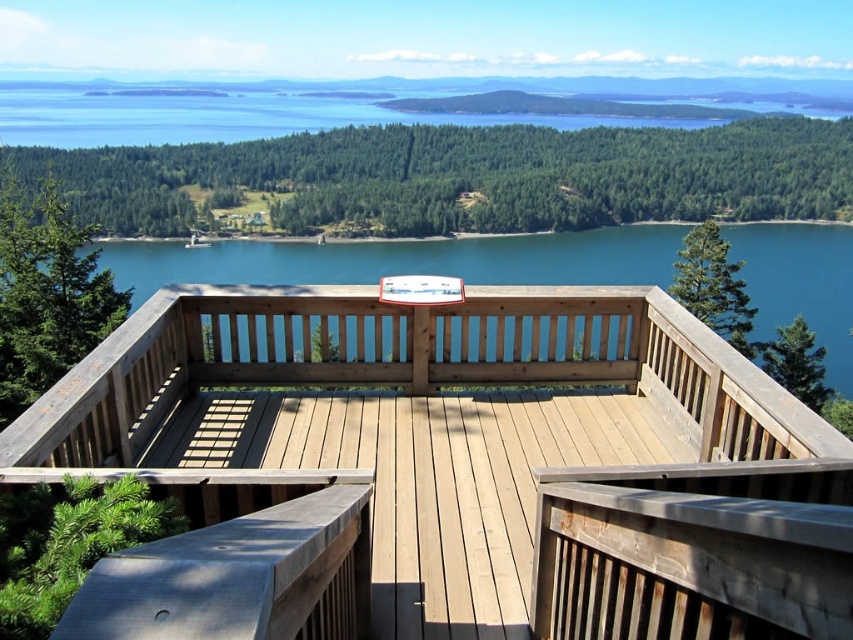
You are standing on the natural wood deck at center and want to take a photo of the blue wooden water at center. Which object is closer to your camera lens when you focus on the water?

The blue wooden water at center is farther away from the camera lens than the natural wood deck at center, so the natural wood deck at center is closer to the camera lens when focusing on the water.